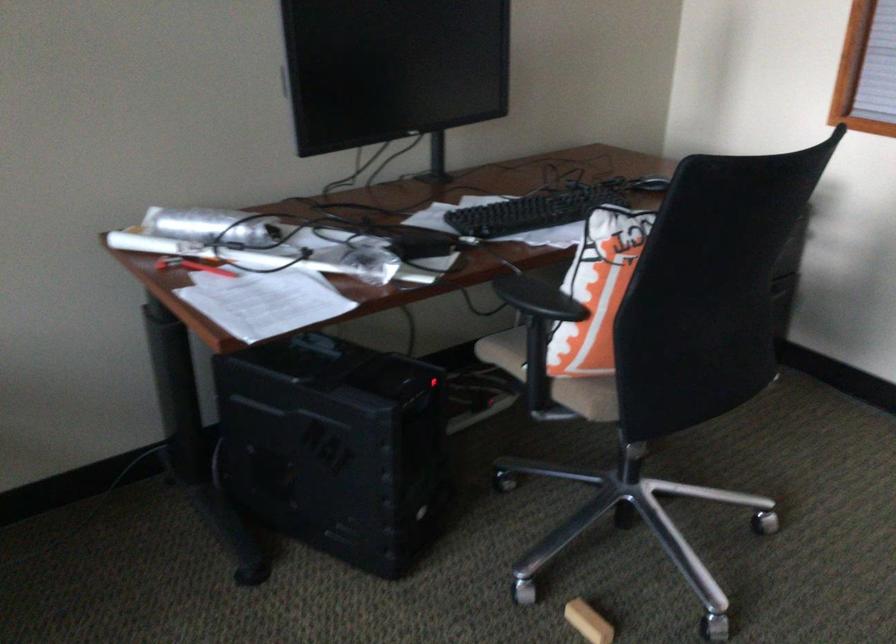
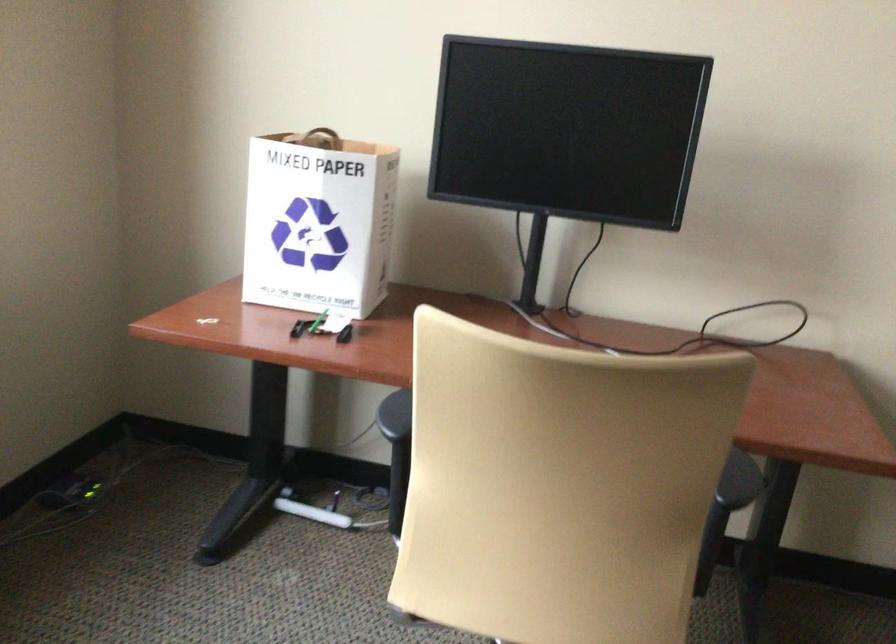
Question: The camera is either moving clockwise (left) or counter-clockwise (right) around the object. The first image is from the beginning of the video and the second image is from the end. Is the camera moving left or right when shooting the video?

Choices:
 (A) Left
 (B) Right

Answer: (B)